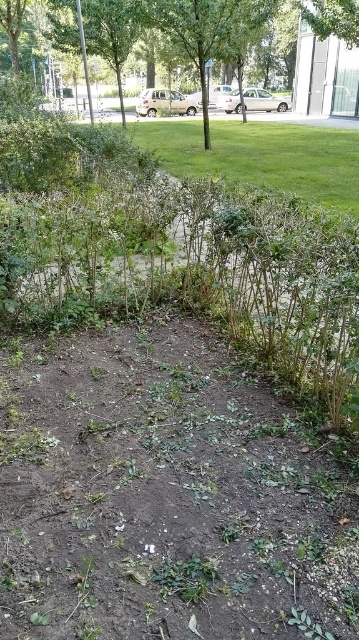
You are a gardener who needs to place a 1.5 meter wide decorative bench between the green leafy tree at upper center and the green leafy tree at center. Based on the space available, will the bench fit comfortably between them?

The distance between the green leafy tree at upper center and the green leafy tree at center is 1.36 meters. Since the bench is 1.5 meters wide, it will not fit comfortably between them as the space is narrower than the bench.

You are standing at the entrance of the garden and see the green leafy tree at upper center and the green leafy tree at center. Which tree is positioned to the left when looking towards the center of the garden?

The green leafy tree at upper center is positioned to the left of the green leafy tree at center when looking towards the center of the garden.